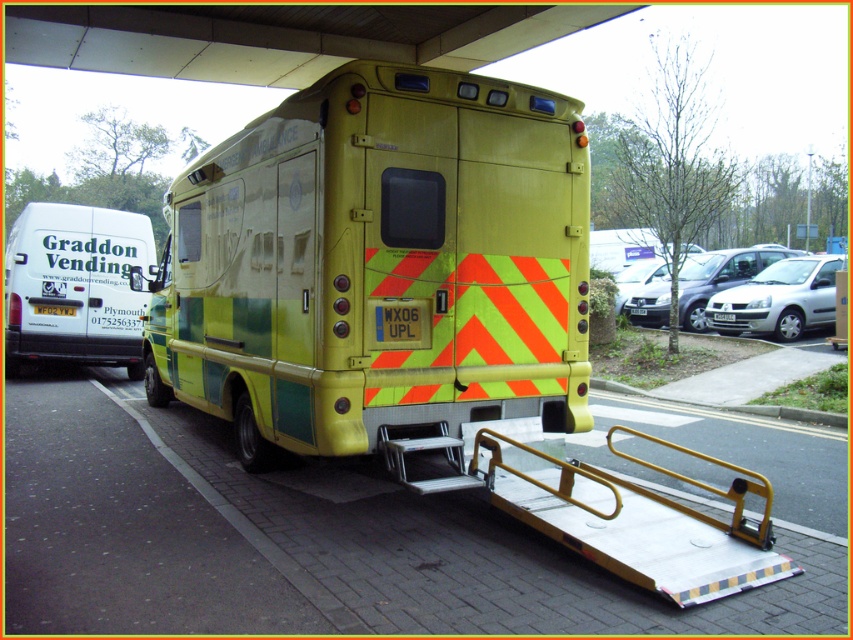
You are standing at a distance and want to read the text on the yellow plastic license plate at rear of the ambulance. Can you read the text clearly from your current position?

The yellow plastic license plate at rear is 15.36 meters away from the viewer, so it might be difficult to read the text clearly from that distance unless you have a visual aid like binoculars.

You are a maintenance worker needing to reach both the yellow plastic license plate at rear and the yellow reflective plate at rear on the ambulance. If your ladder is 2 meters long, can you safely place it between them to access both plates without moving the ladder?

The distance between the yellow plastic license plate at rear and the yellow reflective plate at rear is 2.04 meters. Since the ladder is only 2 meters long, it is 4 centimeters too short to span the gap between them. You will need a longer ladder to safely reach both plates.